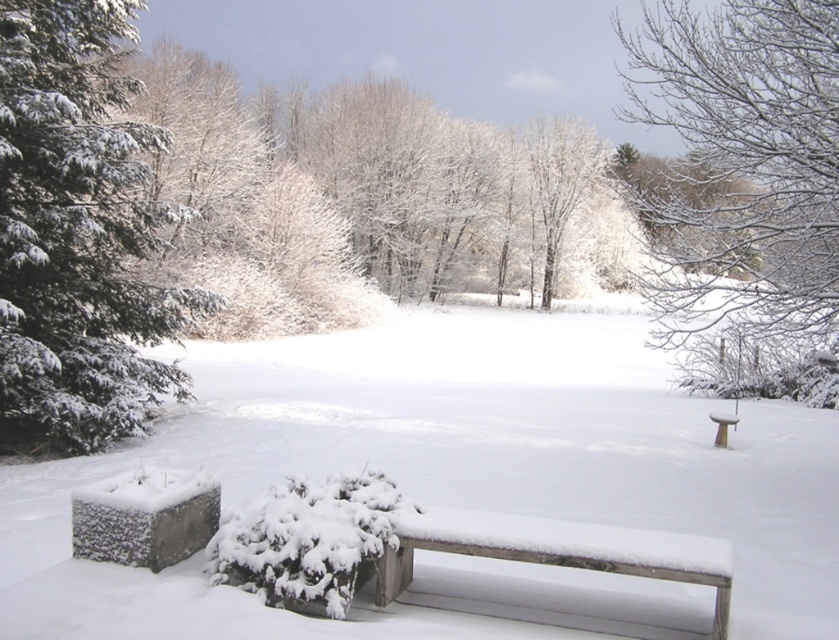
Question: Which object is farther from the camera taking this photo?

Choices:
 (A) snow-covered wood bench at lower center
 (B) snow-covered evergreen at left
 (C) white wooden bench at center
 (D) white matte snow at center

Answer: (C)

Question: Which of the following is the closest to the observer?

Choices:
 (A) (732, 417)
 (B) (780, 529)

Answer: (B)

Question: Is white matte snow at center positioned behind snow-covered evergreen at left?

Choices:
 (A) no
 (B) yes

Answer: (A)

Question: Which object is the closest to the snow-covered wood bench at lower center?

Choices:
 (A) snow-covered branches at upper right
 (B) white matte snow at center
 (C) snow-covered evergreen at left

Answer: (B)

Question: Can you confirm if white matte snow at center is positioned to the left of snow-covered evergreen at left?

Choices:
 (A) no
 (B) yes

Answer: (A)

Question: Does white matte snow at center come behind snow-covered branches at upper right?

Choices:
 (A) yes
 (B) no

Answer: (B)